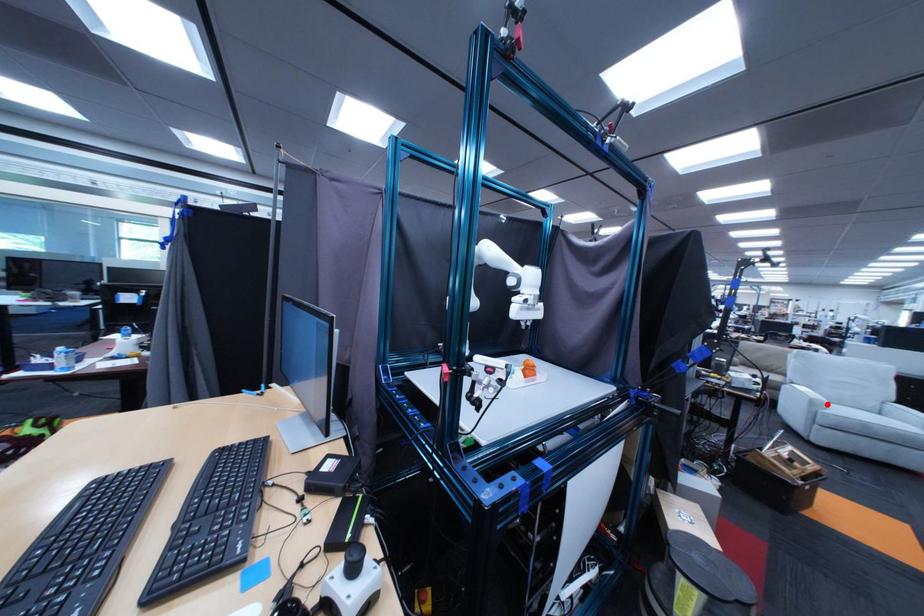
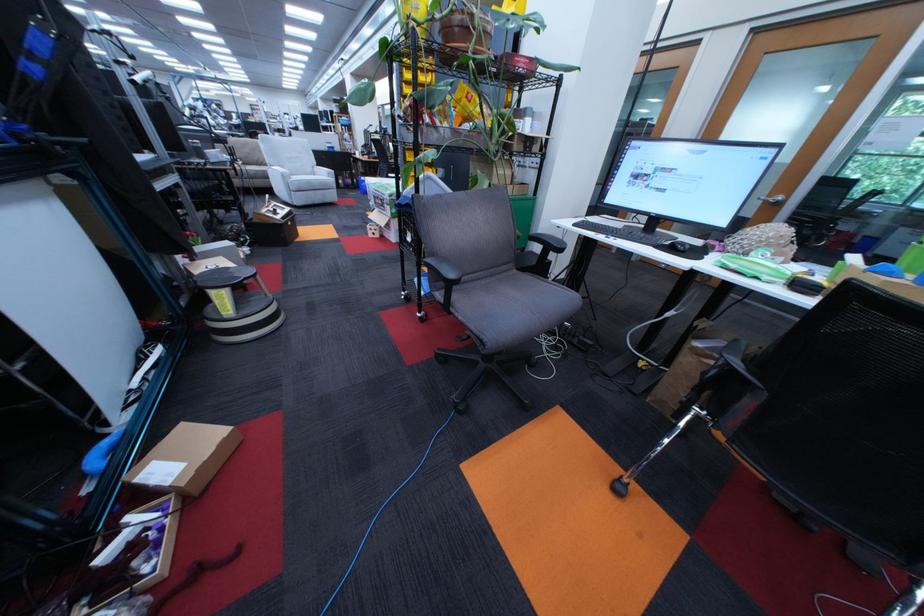
Find the pixel in the second image that matches the highlighted location in the first image.

(298, 177)